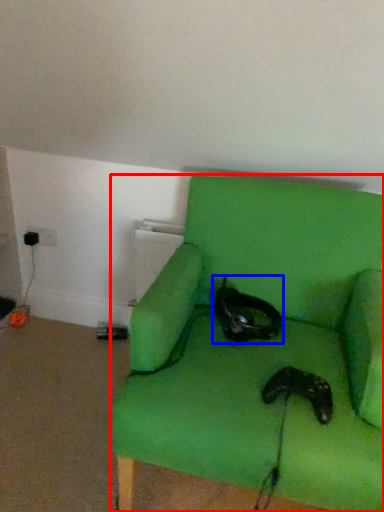
Question: Which object appears closest to the camera in this image, chair (highlighted by a red box) or cat (highlighted by a blue box)?

Choices:
 (A) chair
 (B) cat

Answer: (A)